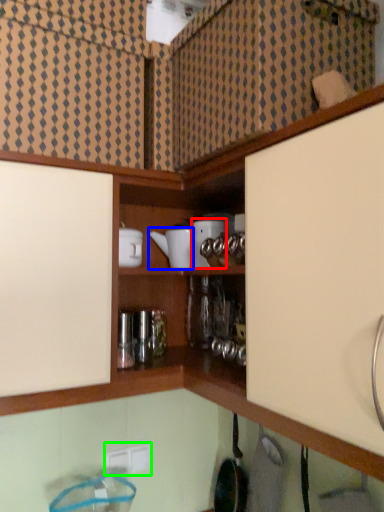
Question: Estimate the real-world distances between objects in this image. Which object is farther from appliance (highlighted by a red box), appliance (highlighted by a blue box) or electric outlet (highlighted by a green box)?

Choices:
 (A) appliance
 (B) electric outlet

Answer: (B)